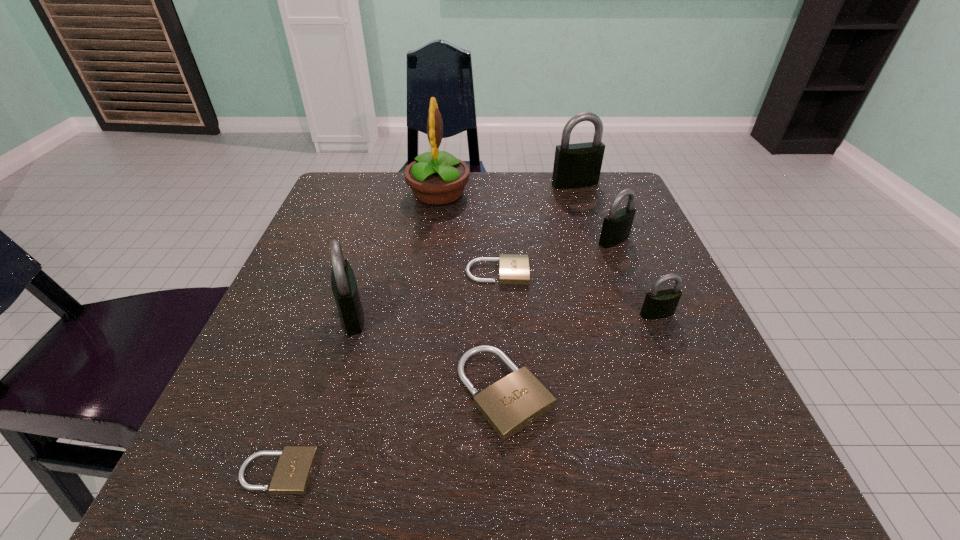
Identify the location of beige padlock that is the second closest to the third smallest black padlock. (513, 269).

Identify which beige padlock is the closest to the farthest padlock. Please provide its 2D coordinates. Your answer should be formatted as a tuple, i.e. [(x, y)], where the tuple contains the x and y coordinates of a point satisfying the conditions above.

[(513, 269)]

The image size is (960, 540). In order to click on free space that satisfies the following two spatial constraints: 1. on the face of the second smallest beige padlock; 2. on the left side of the sunflower in this screenshot , I will do `click(428, 273)`.

Identify the location of free location that satisfies the following two spatial constraints: 1. on the back side of the biggest black padlock; 2. on the right side of the farthest beige padlock. The height and width of the screenshot is (540, 960). (493, 184).

Where is `vacant area in the image that satisfies the following two spatial constraints: 1. on the front side of the farthest beige padlock; 2. on the left side of the fifth tallest object`? vacant area in the image that satisfies the following two spatial constraints: 1. on the front side of the farthest beige padlock; 2. on the left side of the fifth tallest object is located at coordinates (499, 314).

Identify the location of vacant space that satisfies the following two spatial constraints: 1. on the back side of the leftmost black padlock; 2. on the left side of the fourth shortest padlock. The width and height of the screenshot is (960, 540). (352, 314).

Identify the location of free space that satisfies the following two spatial constraints: 1. on the back side of the second smallest beige padlock; 2. on the right side of the leftmost black padlock. This screenshot has width=960, height=540. (365, 273).